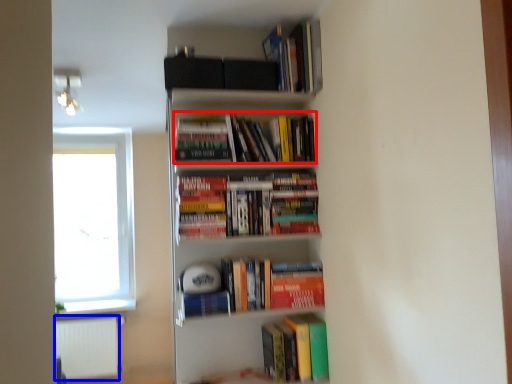
Question: Among these objects, which one is nearest to the camera, book (highlighted by a red box) or cabinet (highlighted by a blue box)?

Choices:
 (A) book
 (B) cabinet

Answer: (A)